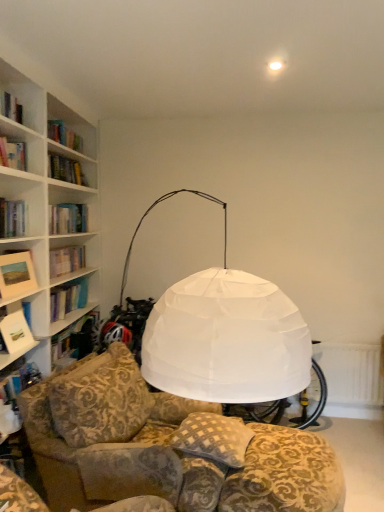
Question: Is white paper book at left at the left side of checkered fabric pillow at center?

Choices:
 (A) yes
 (B) no

Answer: (A)

Question: Does white paper book at left have a smaller size compared to checkered fabric pillow at center?

Choices:
 (A) yes
 (B) no

Answer: (A)

Question: Is white paper book at left outside checkered fabric pillow at center?

Choices:
 (A) yes
 (B) no

Answer: (A)

Question: Is white paper book at left behind checkered fabric pillow at center?

Choices:
 (A) yes
 (B) no

Answer: (A)

Question: Is the depth of white paper book at left less than that of checkered fabric pillow at center?

Choices:
 (A) no
 (B) yes

Answer: (A)

Question: Considering the positions of white textured radiator at lower right and checkered fabric pillow at center in the image, is white textured radiator at lower right taller or shorter than checkered fabric pillow at center?

Choices:
 (A) tall
 (B) short

Answer: (A)

Question: From the image's perspective, is white textured radiator at lower right positioned above or below checkered fabric pillow at center?

Choices:
 (A) above
 (B) below

Answer: (B)

Question: In the image, is white textured radiator at lower right on the left side or the right side of checkered fabric pillow at center?

Choices:
 (A) right
 (B) left

Answer: (A)

Question: In terms of size, does white textured radiator at lower right appear bigger or smaller than checkered fabric pillow at center?

Choices:
 (A) small
 (B) big

Answer: (A)

Question: From a real-world perspective, relative to white textured radiator at lower right, is checkered fabric pillow at center vertically above or below?

Choices:
 (A) above
 (B) below

Answer: (A)

Question: In terms of height, does checkered fabric pillow at center look taller or shorter compared to white textured radiator at lower right?

Choices:
 (A) short
 (B) tall

Answer: (A)

Question: In terms of size, does checkered fabric pillow at center appear bigger or smaller than white textured radiator at lower right?

Choices:
 (A) small
 (B) big

Answer: (B)

Question: Would you say checkered fabric pillow at center is to the left or to the right of white textured radiator at lower right in the picture?

Choices:
 (A) right
 (B) left

Answer: (B)

Question: Looking at their shapes, would you say matte white picture frame at left is wider or thinner than checkered fabric pillow at center?

Choices:
 (A) thin
 (B) wide

Answer: (A)

Question: From a real-world perspective, is matte white picture frame at left positioned above or below checkered fabric pillow at center?

Choices:
 (A) below
 (B) above

Answer: (B)